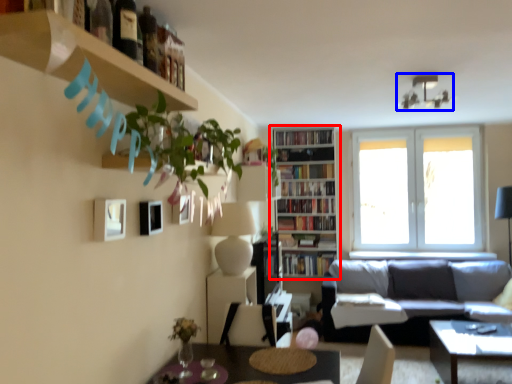
Question: Among these objects, which one is nearest to the camera, bookcase (highlighted by a red box) or lamp (highlighted by a blue box)?

Choices:
 (A) bookcase
 (B) lamp

Answer: (B)